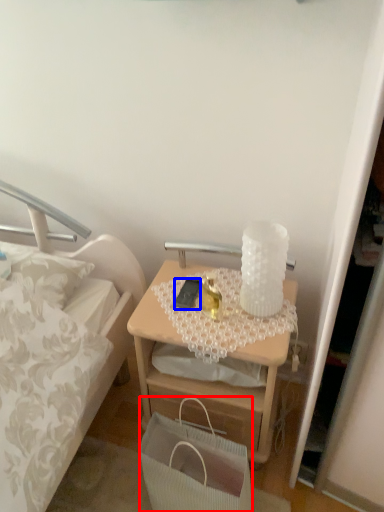
Question: Among these objects, which one is farthest to the camera, handbag (highlighted by a red box) or mobile phone (highlighted by a blue box)?

Choices:
 (A) handbag
 (B) mobile phone

Answer: (B)